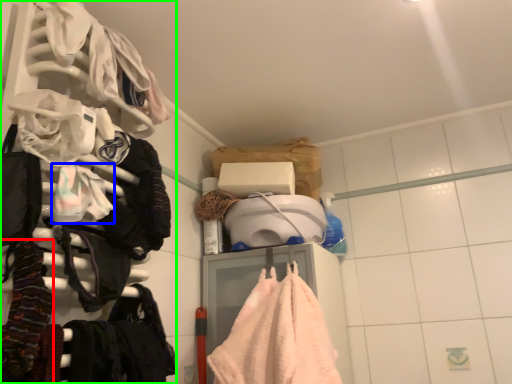
Question: Which is nearer to the clothing (highlighted by a red box)? clothing (highlighted by a blue box) or closet (highlighted by a green box).

Choices:
 (A) clothing
 (B) closet

Answer: (A)